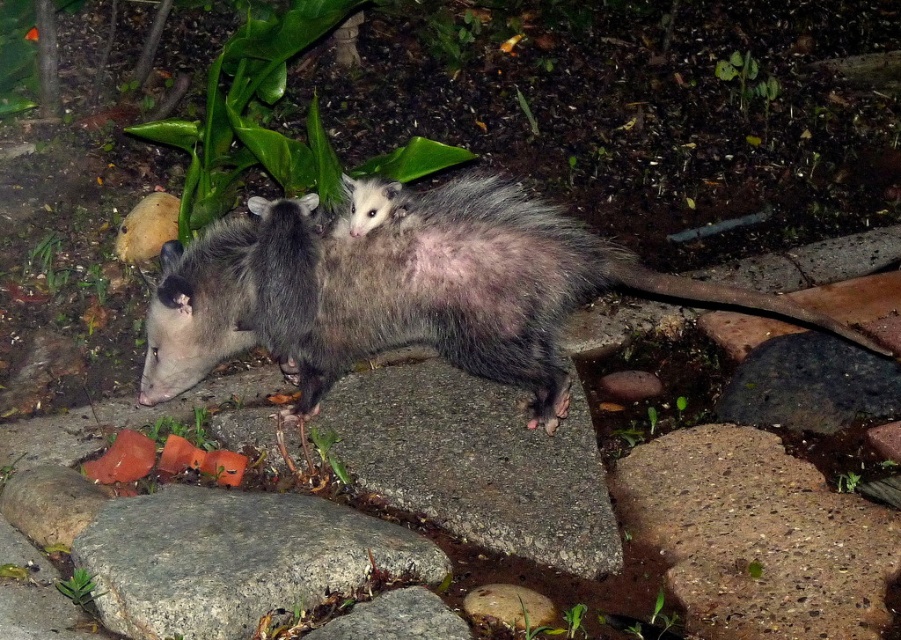
Question: Is gray rough stone at center wider than gray smooth rock at center?

Choices:
 (A) no
 (B) yes

Answer: (B)

Question: Does fuzzy gray opossum at center appear on the right side of smooth orange slices at lower left?

Choices:
 (A) no
 (B) yes

Answer: (B)

Question: Which point appears closest to the camera in this image?

Choices:
 (A) (132, 449)
 (B) (281, 333)
 (C) (338, 563)
 (D) (353, 621)

Answer: (D)

Question: Can you confirm if gray rough stone at center is thinner than gray smooth rock at center?

Choices:
 (A) no
 (B) yes

Answer: (A)

Question: Which of the following is the closest to the observer?

Choices:
 (A) smooth orange slices at lower left
 (B) gray smooth rock at center

Answer: (B)

Question: Which point is closer to the camera?

Choices:
 (A) [x=178, y=308]
 (B) [x=125, y=592]
 (C) [x=396, y=612]
 (D) [x=228, y=451]

Answer: (B)